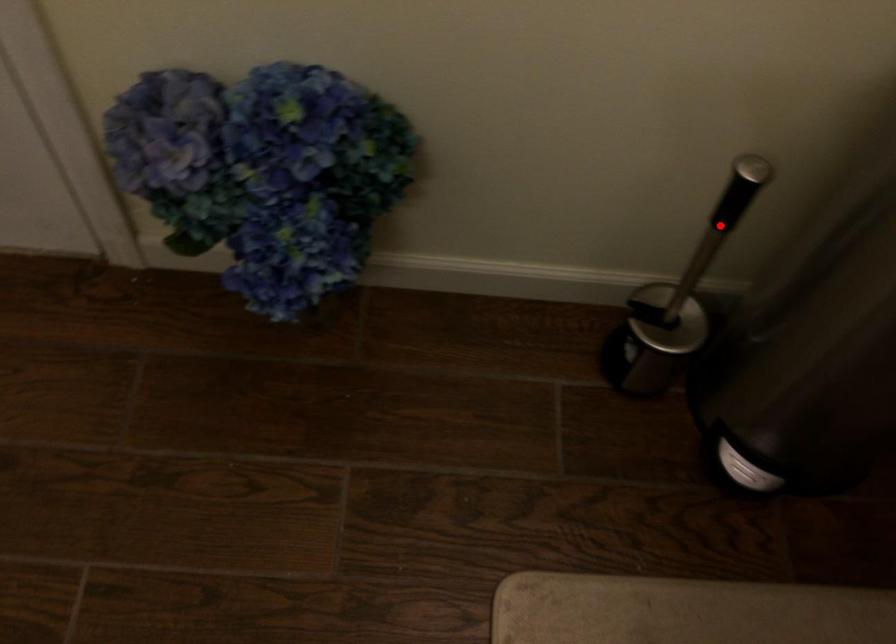
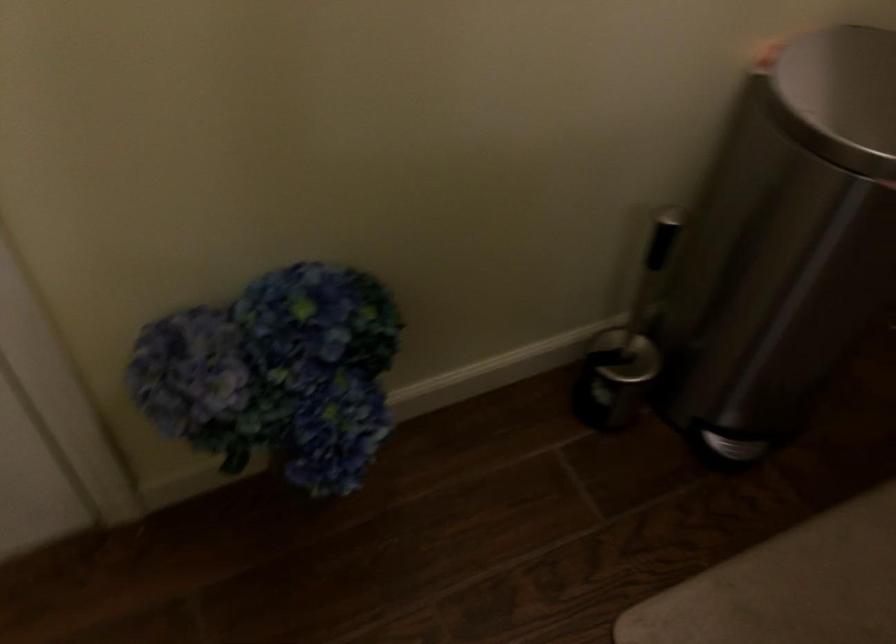
Question: I am providing you with two images of the same scene from different viewpoints. A red point is marked on the first image. Is the red point's position out of view in image 2?

Choices:
 (A) Yes
 (B) No

Answer: (A)